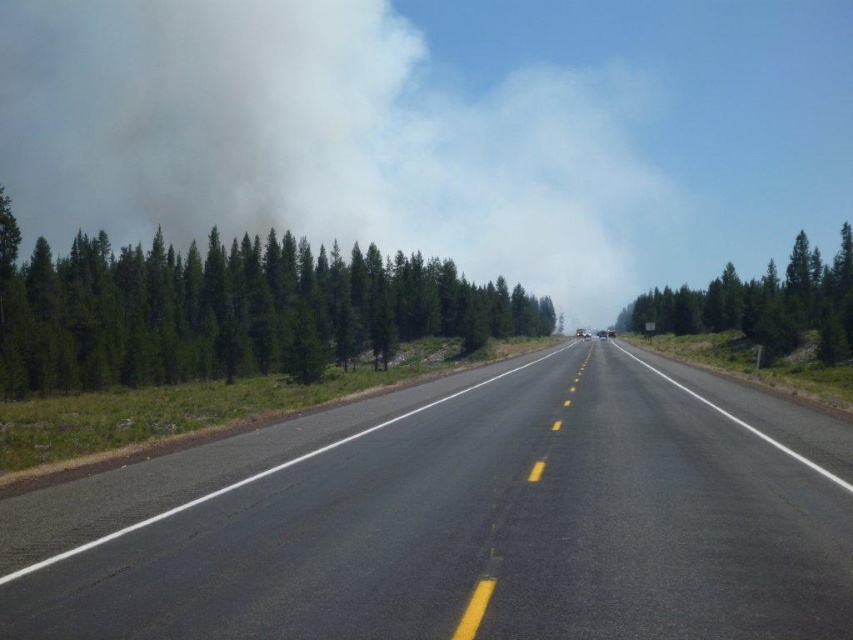
You are a drone operator planning to capture aerial footage of the black asphalt highway at center. The drone must stay within a 100m radius of the highway. Based on the scene description, can you confirm if the drone will remain within the designated radius while flying over the highway?

The black asphalt highway at center is positioned at point coordinates, but without specific spatial measurements between the highway and the drone flight path, it is impossible to determine if the drone will stay within the 100m radius. The scene description does not provide enough information about the drone path relative to the highway.

You are a driver approaching the highway and notice the white smoke at upper center and the green textured tree at right. Which object appears closer to you in the scene?

The white smoke at upper center appears closer because smaller objects in the distance can appear closer when they are actually smaller in size, but according to the description, it is smaller than the green textured tree at right, which might be closer or farther depending on perspective. Wait, the description says the white smoke is smaller than the tree. In perspective, smaller objects can be farther away. Since the smoke is smaller, it might be farther, but the question is about which appears closer. Hm

You are a driver approaching the highway and notice the white smoke at upper center and the green textured tree at right. Which object appears higher in the image?

The white smoke at upper center is located above the green textured tree at right, so it appears higher in the image.